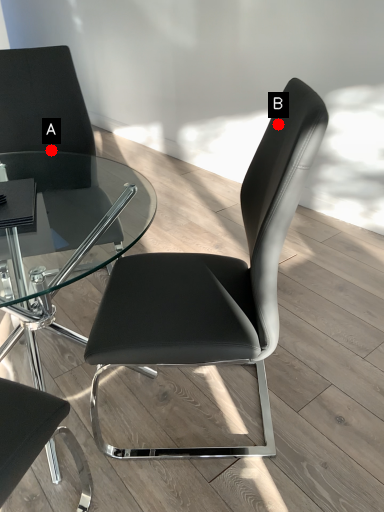
Question: Two points are circled on the image, labeled by A and B beside each circle. Which point is further to the camera?

Choices:
 (A) A is further
 (B) B is further

Answer: (A)